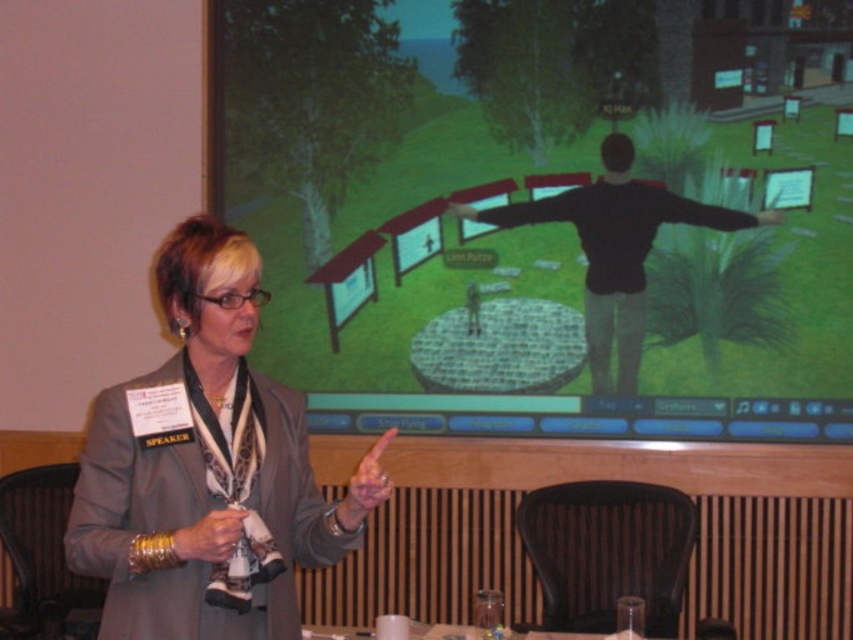
You are an attendee at a tech conference and see the woman presenting. You want to check if her gray fabric jacket at center is covering her black matte shirt at center. Based on the description, can you determine this?

The gray fabric jacket at center is located below the black matte shirt at center, so the jacket is not covering the shirt. The shirt is above the jacket.

You are an attendee at a tech conference and see the matte black projection screen at upper center and the gray fabric jacket at center. Which object is located to the right of the other?

The matte black projection screen at upper center is positioned on the right side of gray fabric jacket at center.